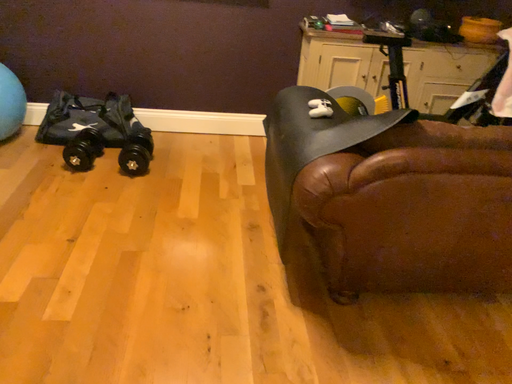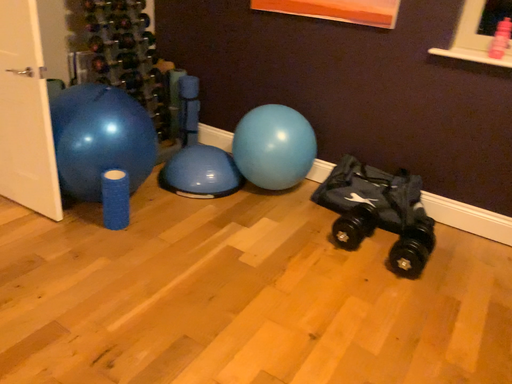
Question: Which way did the camera rotate in the video?

Choices:
 (A) rotated right
 (B) rotated left

Answer: (B)